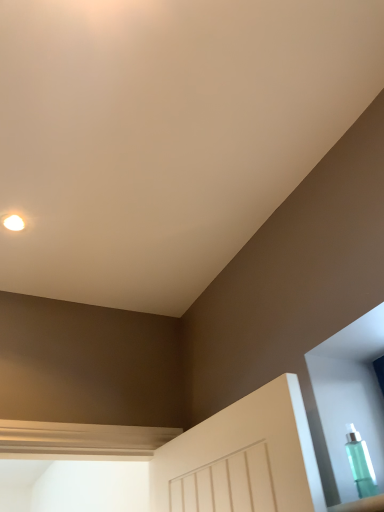
The image size is (384, 512). What are the coordinates of `matte white droplight at upper left` in the screenshot? It's located at (14, 223).

This screenshot has width=384, height=512. What do you see at coordinates (14, 223) in the screenshot? I see `matte white droplight at upper left` at bounding box center [14, 223].

Measure the distance between matte white droplight at upper left and camera.

matte white droplight at upper left and camera are 1.32 meters apart from each other.

What do you see at coordinates (360, 463) in the screenshot? The width and height of the screenshot is (384, 512). I see `transparent plastic bottle at lower right` at bounding box center [360, 463].

From the picture: In order to face transparent plastic bottle at lower right, should I rotate leftwards or rightwards?

You should rotate right by 21.252 degrees.

Image resolution: width=384 pixels, height=512 pixels. Identify the location of transparent plastic bottle at lower right. (360, 463).

Measure the distance between point (360, 490) and camera.

Point (360, 490) and camera are 94.50 centimeters apart.

Find the location of a particular element. matte white droplight at upper left is located at coordinates (14, 223).

Considering the positions of objects transparent plastic bottle at lower right and matte white droplight at upper left in the image provided, who is more to the right, transparent plastic bottle at lower right or matte white droplight at upper left?

transparent plastic bottle at lower right is more to the right.

Relative to matte white droplight at upper left, is transparent plastic bottle at lower right in front or behind?

transparent plastic bottle at lower right is positioned closer to the viewer than matte white droplight at upper left.

Is point (364, 448) positioned before point (19, 223)?

Yes, it is.

From the image's perspective, is transparent plastic bottle at lower right below matte white droplight at upper left?

Indeed, from the image's perspective, transparent plastic bottle at lower right is shown beneath matte white droplight at upper left.

Looking at this image, from a real-world perspective, is transparent plastic bottle at lower right on matte white droplight at upper left?

No, from a real-world perspective, transparent plastic bottle at lower right is not above matte white droplight at upper left.

Is transparent plastic bottle at lower right thinner than matte white droplight at upper left?

Indeed, transparent plastic bottle at lower right has a lesser width compared to matte white droplight at upper left.

Considering the relative sizes of transparent plastic bottle at lower right and matte white droplight at upper left in the image provided, is transparent plastic bottle at lower right shorter than matte white droplight at upper left?

No.

Considering the sizes of objects transparent plastic bottle at lower right and matte white droplight at upper left in the image provided, who is smaller, transparent plastic bottle at lower right or matte white droplight at upper left?

With smaller size is matte white droplight at upper left.

Can matte white droplight at upper left be found inside transparent plastic bottle at lower right?

No, matte white droplight at upper left is not surrounded by transparent plastic bottle at lower right.

Would you consider transparent plastic bottle at lower right to be distant from matte white droplight at upper left?

Indeed, transparent plastic bottle at lower right is not near matte white droplight at upper left.

Is transparent plastic bottle at lower right oriented away from matte white droplight at upper left?

No, matte white droplight at upper left is not at the back of transparent plastic bottle at lower right.

How many degrees apart are the facing directions of transparent plastic bottle at lower right and matte white droplight at upper left?

They differ by 86.9 degrees in their facing directions.

Identify the location of bottle located on the right of matte white droplight at upper left. The image size is (384, 512). (360, 463).

Which is more to the right, matte white droplight at upper left or transparent plastic bottle at lower right?

Positioned to the right is transparent plastic bottle at lower right.

Which object is further away from the camera taking this photo, matte white droplight at upper left or transparent plastic bottle at lower right?

matte white droplight at upper left.

Which is behind, point (9, 219) or point (362, 495)?

The point (9, 219) is farther.

From the image's perspective, is matte white droplight at upper left positioned above or below transparent plastic bottle at lower right?

From the image's perspective, matte white droplight at upper left appears above transparent plastic bottle at lower right.

From a real-world perspective, is matte white droplight at upper left above or below transparent plastic bottle at lower right?

matte white droplight at upper left is above transparent plastic bottle at lower right.

Which of these two, matte white droplight at upper left or transparent plastic bottle at lower right, is wider?

matte white droplight at upper left is wider.

Between matte white droplight at upper left and transparent plastic bottle at lower right, which one has less height?

matte white droplight at upper left is shorter.

Between matte white droplight at upper left and transparent plastic bottle at lower right, which one has smaller size?

matte white droplight at upper left is smaller.

Is transparent plastic bottle at lower right completely or partially inside matte white droplight at upper left?

No, matte white droplight at upper left does not contain transparent plastic bottle at lower right.

Are matte white droplight at upper left and transparent plastic bottle at lower right located far from each other?

That's right, there is a large distance between matte white droplight at upper left and transparent plastic bottle at lower right.

Does matte white droplight at upper left turn towards transparent plastic bottle at lower right?

No, matte white droplight at upper left is not aimed at transparent plastic bottle at lower right.

Looking at this image, how different are the orientations of matte white droplight at upper left and transparent plastic bottle at lower right in degrees?

The angle between the facing direction of matte white droplight at upper left and the facing direction of transparent plastic bottle at lower right is 86.9 degrees.

Identify the location of bottle directly beneath the matte white droplight at upper left (from a real-world perspective). (360, 463).

You are a GUI agent. You are given a task and a screenshot of the screen. Output one action in this format:
    pyautogui.click(x=<x>, y=<y>)
    Task: Click on the bottle on the right of matte white droplight at upper left
    The height and width of the screenshot is (512, 384).
    Given the screenshot: What is the action you would take?
    pyautogui.click(x=360, y=463)

The width and height of the screenshot is (384, 512). I want to click on bottle in front of the matte white droplight at upper left, so click(x=360, y=463).